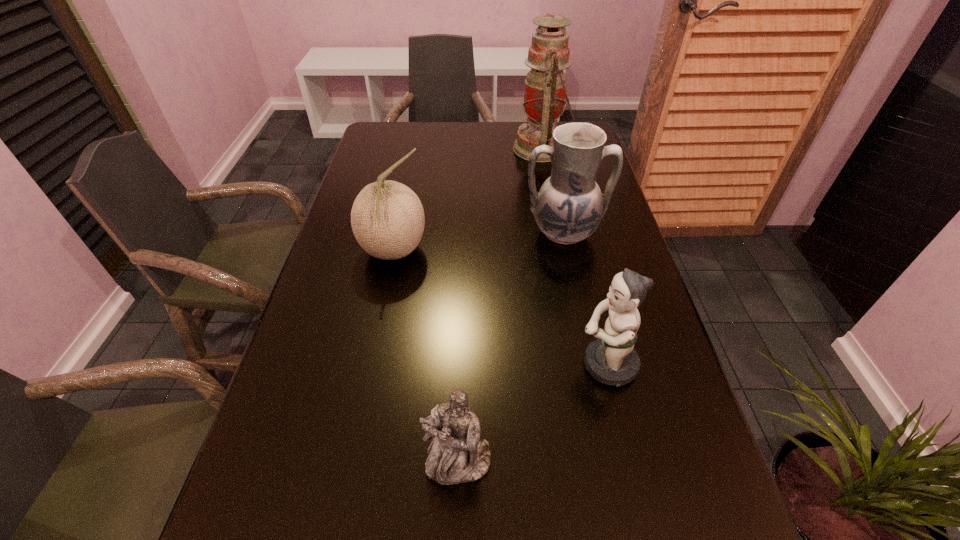
Locate an element on the screen. vacant space located 0.380m on the right of the cantaloup is located at coordinates (574, 252).

Where is `free location located on the front-facing side of the farther figurine`? free location located on the front-facing side of the farther figurine is located at coordinates (379, 364).

Find the location of a particular element. vacant area situated on the front-facing side of the farther figurine is located at coordinates (527, 364).

You are a GUI agent. You are given a task and a screenshot of the screen. Output one action in this format:
    pyautogui.click(x=<x>, y=<y>)
    Task: Click on the free space located 0.190m on the front-facing side of the farther figurine
    
    Given the screenshot: What is the action you would take?
    pyautogui.click(x=483, y=364)

The width and height of the screenshot is (960, 540). Find the location of `free location located 0.070m on the front-facing side of the fourth object from right to left`. free location located 0.070m on the front-facing side of the fourth object from right to left is located at coordinates (456, 532).

Find the location of `object present at the far edge`. object present at the far edge is located at coordinates (545, 91).

Locate an element on the screen. The width and height of the screenshot is (960, 540). object located at the left edge is located at coordinates (387, 218).

At what (x,y) coordinates should I click in order to perform the action: click on oil lamp present at the right edge. Please return your answer as a coordinate pair (x, y). Looking at the image, I should click on (545, 91).

The image size is (960, 540). I want to click on pitcher situated at the right edge, so click(x=569, y=206).

Find the location of a particular element. The image size is (960, 540). figurine situated at the right edge is located at coordinates (611, 359).